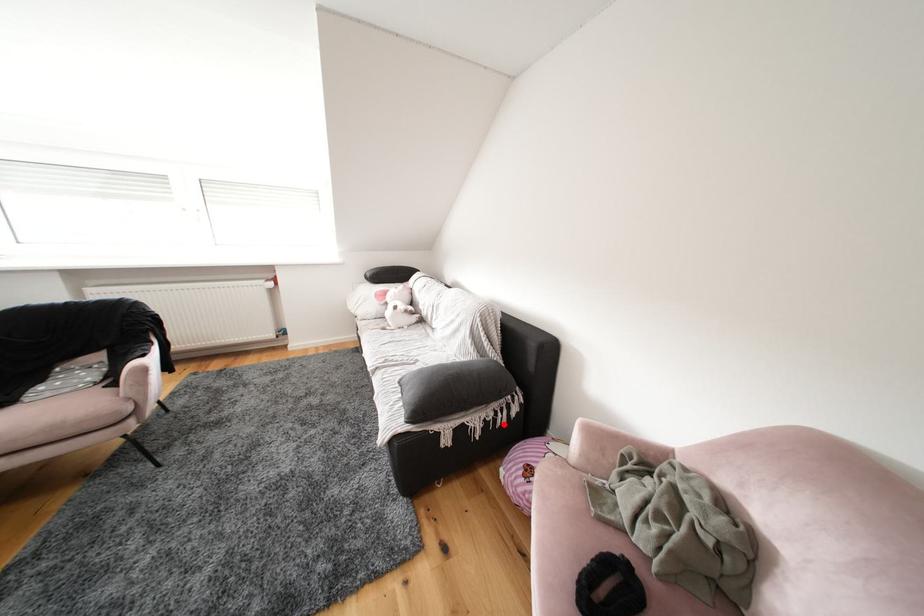
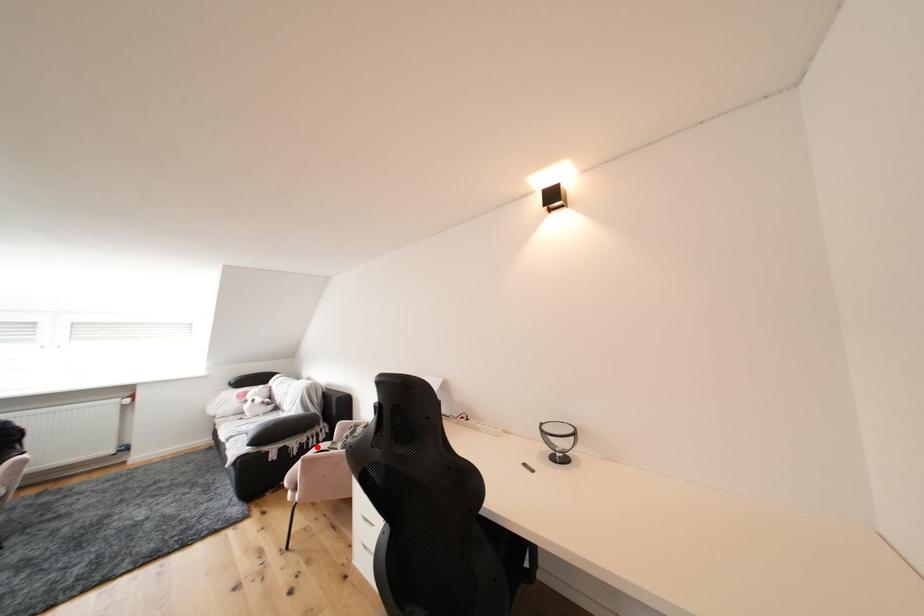
I am providing you with two images of the same scene from different viewpoints. A red point is marked on the first image and another point is marked on the second image. Do the highlighted points in image1 and image2 indicate the same real-world spot?

Yes